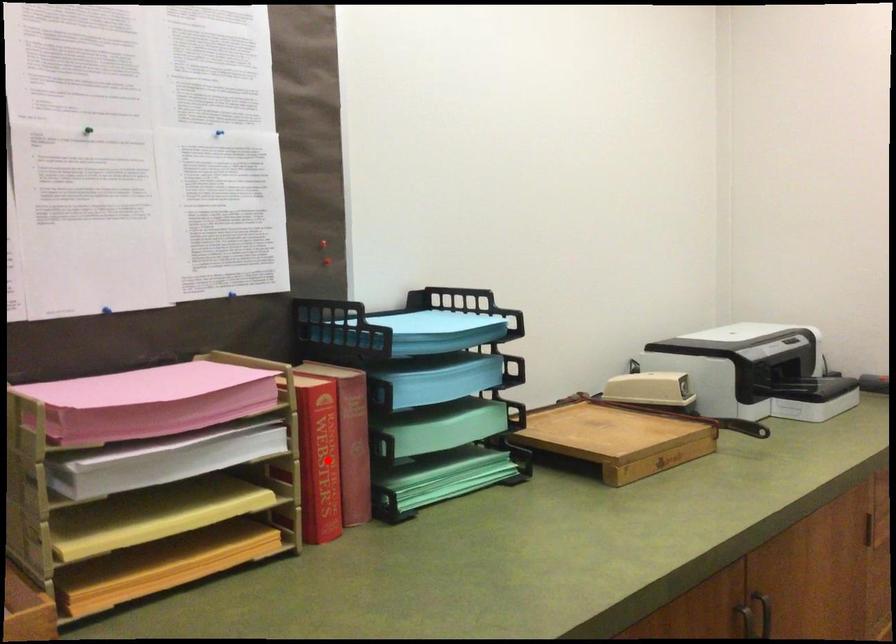
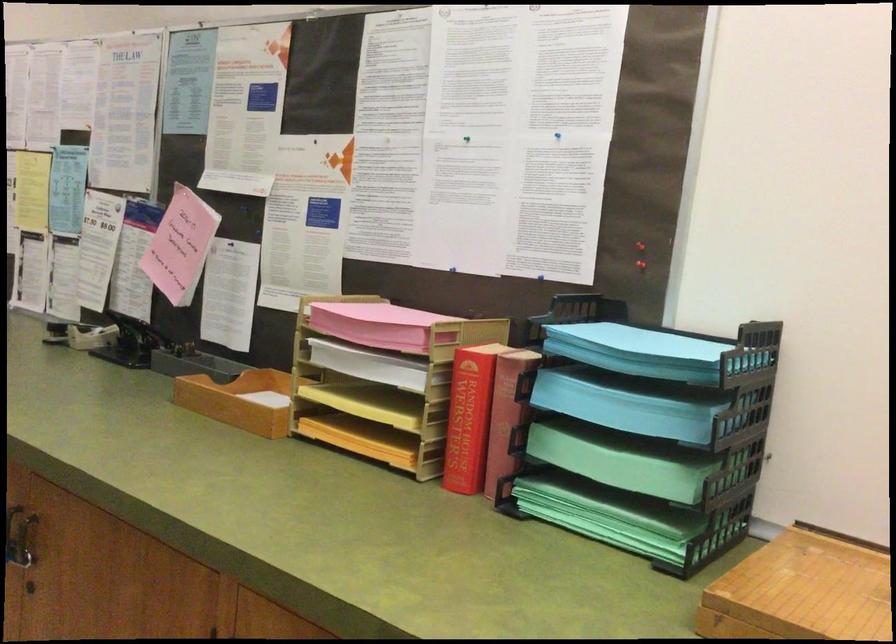
Question: A red point is marked in image1. In image2, is the corresponding 3D point closer to the camera or farther? Reply with the corresponding letter.

Choices:
 (A) The corresponding 3D point is closer.
 (B) The corresponding 3D point is farther.

Answer: (B)